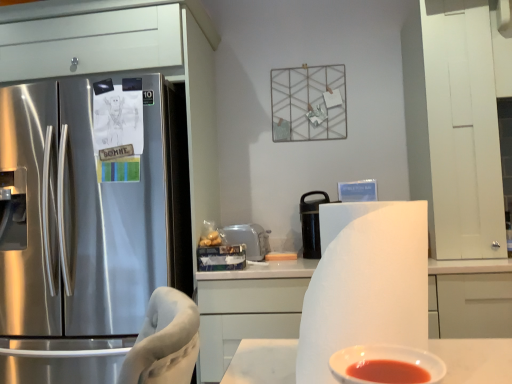
Question: Is white matte paper towel at center further to camera compared to white plastic toaster at center, which ranks as the second appliance in right-to-left order?

Choices:
 (A) no
 (B) yes

Answer: (A)

Question: Can you confirm if white matte paper towel at center is taller than white plastic toaster at center, which ranks as the second appliance in right-to-left order?

Choices:
 (A) no
 (B) yes

Answer: (B)

Question: Is white matte paper towel at center in front of white plastic toaster at center, which ranks as the first appliance in left-to-right order?

Choices:
 (A) no
 (B) yes

Answer: (B)

Question: Is white matte paper towel at center to the right of white plastic toaster at center, which ranks as the first appliance in left-to-right order, from the viewer's perspective?

Choices:
 (A) no
 (B) yes

Answer: (B)

Question: Considering the relative sizes of white matte paper towel at center and white plastic toaster at center, which ranks as the second appliance in right-to-left order, in the image provided, is white matte paper towel at center shorter than white plastic toaster at center, which ranks as the second appliance in right-to-left order,?

Choices:
 (A) no
 (B) yes

Answer: (A)

Question: Is black matte thermos at center, which is counted as the 2th appliance, starting from the left, in front of or behind white plastic toaster at center, which ranks as the second appliance in right-to-left order, in the image?

Choices:
 (A) behind
 (B) front

Answer: (A)

Question: Visually, is black matte thermos at center, which is counted as the 2th appliance, starting from the left, positioned to the left or to the right of white plastic toaster at center, which ranks as the second appliance in right-to-left order?

Choices:
 (A) left
 (B) right

Answer: (B)

Question: From the image's perspective, is black matte thermos at center, which is counted as the 1th appliance, starting from the right, above or below white plastic toaster at center, which ranks as the second appliance in right-to-left order?

Choices:
 (A) above
 (B) below

Answer: (A)

Question: Is black matte thermos at center, which is counted as the 2th appliance, starting from the left, wider or thinner than white plastic toaster at center, which ranks as the first appliance in left-to-right order?

Choices:
 (A) wide
 (B) thin

Answer: (B)

Question: Considering the relative positions of stainless steel refrigerator at left and white matte cabinet at center in the image provided, is stainless steel refrigerator at left to the left or to the right of white matte cabinet at center?

Choices:
 (A) left
 (B) right

Answer: (A)

Question: From the image's perspective, is stainless steel refrigerator at left above or below white matte cabinet at center?

Choices:
 (A) above
 (B) below

Answer: (A)

Question: Looking at their shapes, would you say stainless steel refrigerator at left is wider or thinner than white matte cabinet at center?

Choices:
 (A) wide
 (B) thin

Answer: (A)

Question: In terms of size, does stainless steel refrigerator at left appear bigger or smaller than white matte cabinet at center?

Choices:
 (A) small
 (B) big

Answer: (B)

Question: Is white matte cabinet at center taller or shorter than stainless steel refrigerator at left?

Choices:
 (A) short
 (B) tall

Answer: (A)

Question: In terms of size, does white matte cabinet at center appear bigger or smaller than stainless steel refrigerator at left?

Choices:
 (A) small
 (B) big

Answer: (A)